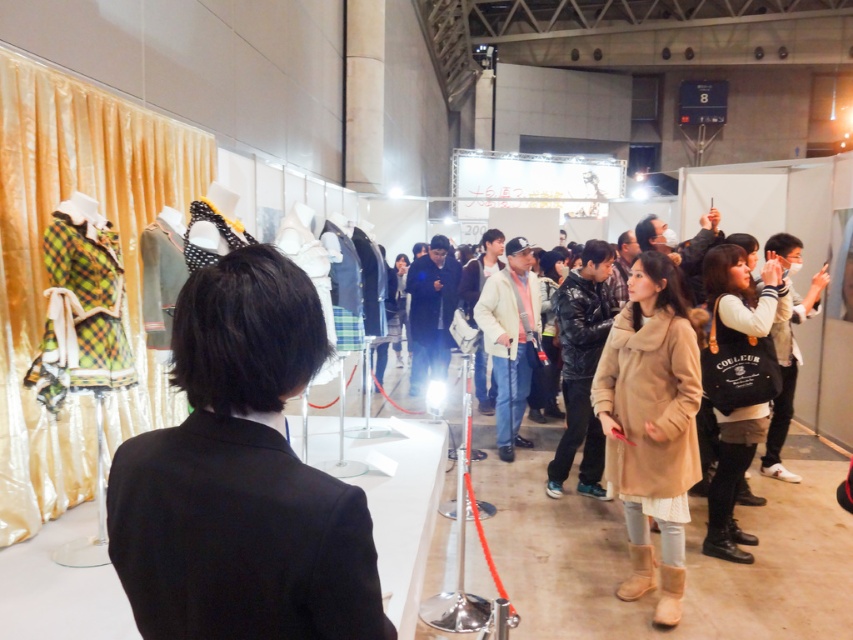
You are a fashion designer trying to arrange your collection in the exhibition hall. You have a black matte blazer at left and a white fleece jacket at center right. Which of these two garments has a smaller width? Please answer based on their positions and the spatial details provided.

The black matte blazer at left has a lesser width compared to the white fleece jacket at center right, so the black matte blazer at left is the one with the smaller width.

You are a fashion designer observing the exhibition. You notice two garments at the center of the display area. Which one is positioned lower between the camel wool coat at center and the light beige jacket at center?

The camel wool coat at center is positioned below the light beige jacket at center, so it is lower.

You are a photographer setting up a shoot in the exhibition hall. You need to decide which garment between the camel wool coat at center and the light beige jacket at center will require more space to properly display. Which one should you allocate more space for?

The light beige jacket at center requires more space because it occupies more space than the camel wool coat at center according to the description.